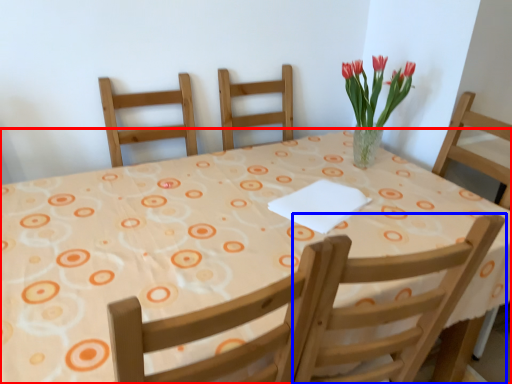
Question: Which object is closer to the camera taking this photo, table (highlighted by a red box) or chair (highlighted by a blue box)?

Choices:
 (A) table
 (B) chair

Answer: (A)